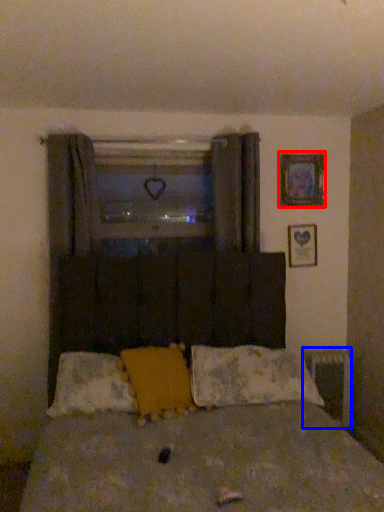
Question: Which of the following is the farthest to the observer, picture frame (highlighted by a red box) or radiator (highlighted by a blue box)?

Choices:
 (A) picture frame
 (B) radiator

Answer: (B)